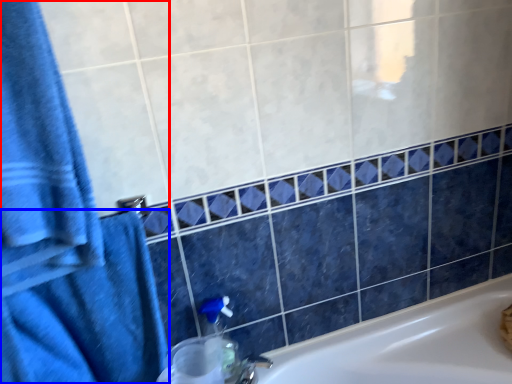
Question: Which object is closer to the camera taking this photo, bath towel (highlighted by a red box) or bath towel (highlighted by a blue box)?

Choices:
 (A) bath towel
 (B) bath towel

Answer: (A)